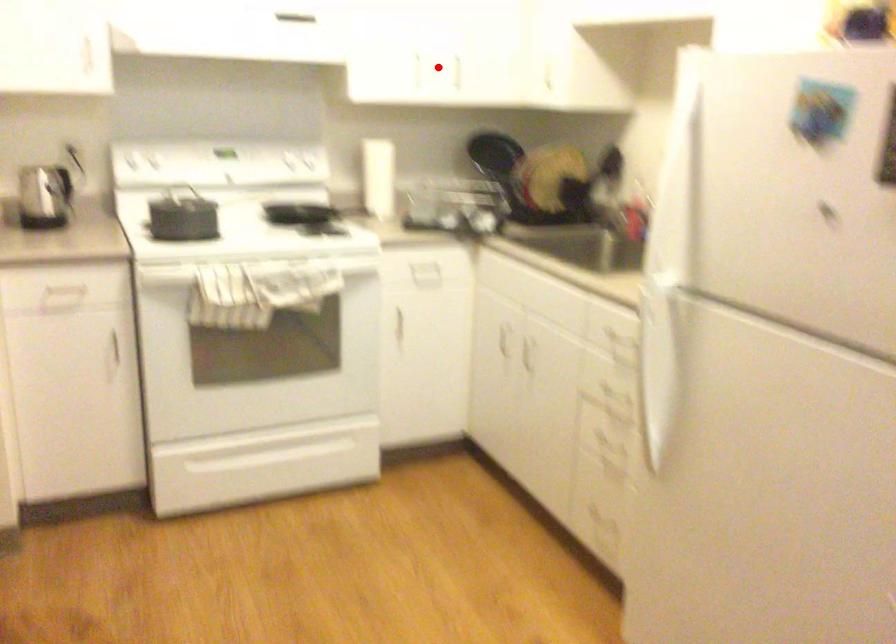
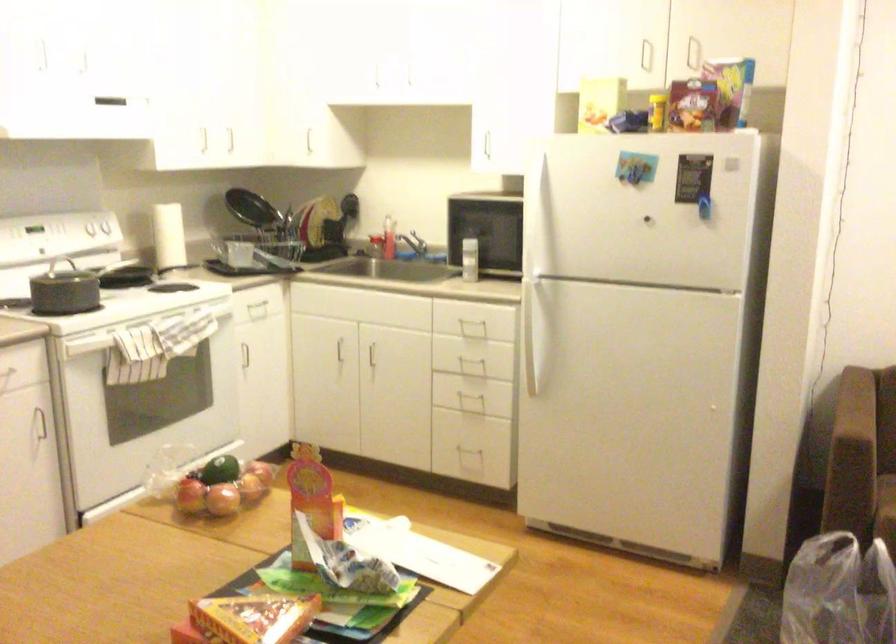
Question: I am providing you with two images of the same scene from different viewpoints. A red point is marked on the first image. Is the red point's position out of view in image 2?

Choices:
 (A) Yes
 (B) No

Answer: (B)